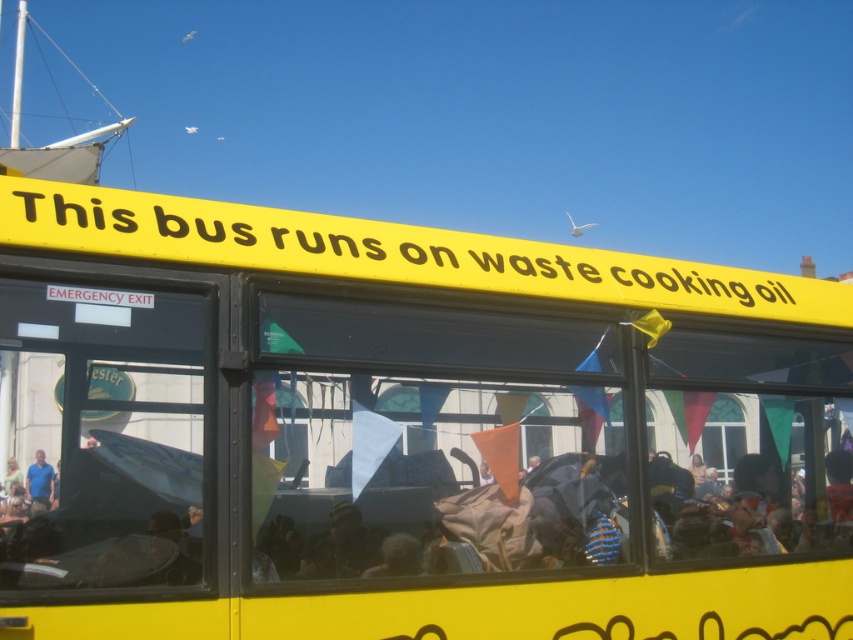
You are standing in front of the yellow bus and want to touch both points on its side. Which point should you reach for first, the point at coordinate (90, 211) or the point at coordinate (41, 490)?

You should reach for the point at coordinate (90, 211) first because it is closer to you than the point at coordinate (41, 490).

You are a bus inspector checking the vehicle for compliance. You notice the yellow matte bus at center and the yellow matte sign at upper center. Which object would you need to examine more closely for potential visibility issues related to size?

The yellow matte sign at upper center is smaller than the yellow matte bus at center, so it might be harder to see and should be examined more closely for visibility issues related to size.

You are a passenger on the bus and want to locate the emergency exit sign. You see the yellow matte sign at upper center and the matte blue shirt at lower left. Which object is higher up in the bus?

The yellow matte sign at upper center is higher up in the bus than the matte blue shirt at lower left.